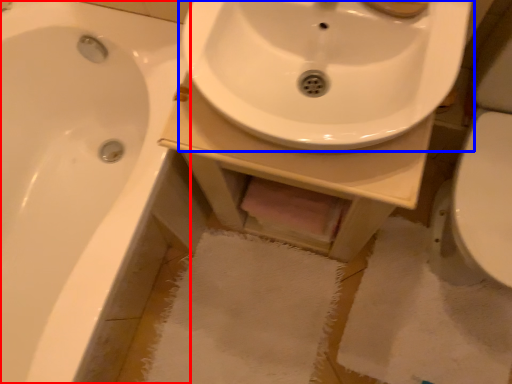
Question: Among these objects, which one is farthest to the camera, bathtub (highlighted by a red box) or sink (highlighted by a blue box)?

Choices:
 (A) bathtub
 (B) sink

Answer: (A)